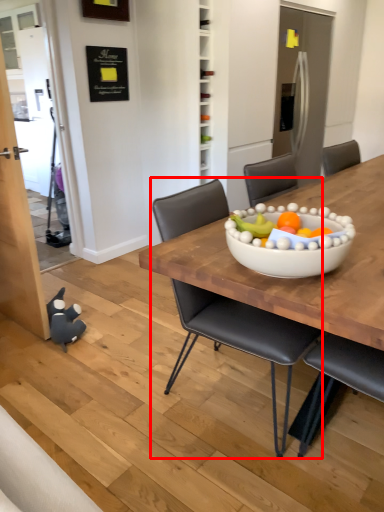
Question: From the image's perspective, what is the correct spatial positioning of chair (annotated by the red box) in reference to toy?

Choices:
 (A) below
 (B) above

Answer: (B)